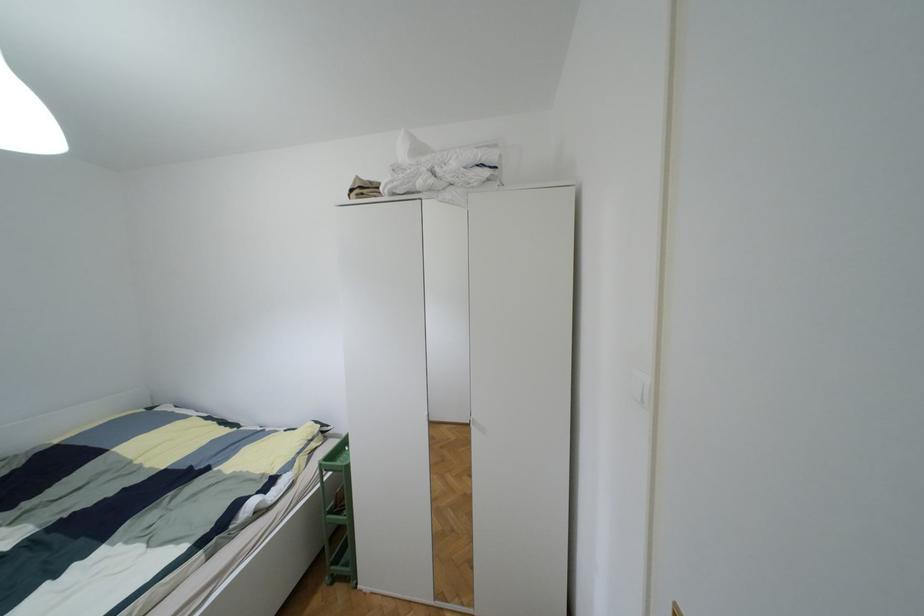
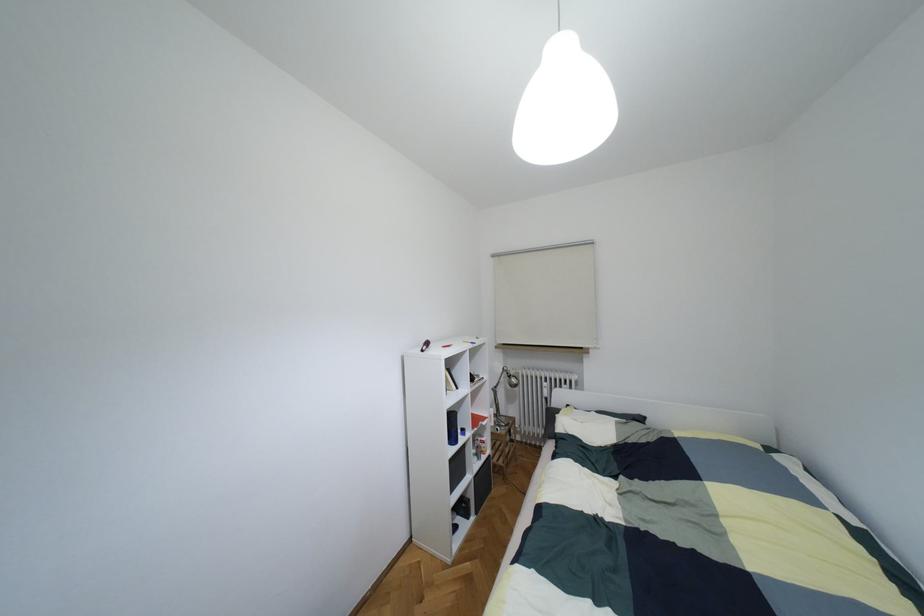
Question: How did the camera likely rotate?

Choices:
 (A) Left
 (B) Right
 (C) Up
 (D) Down

Answer: (A)